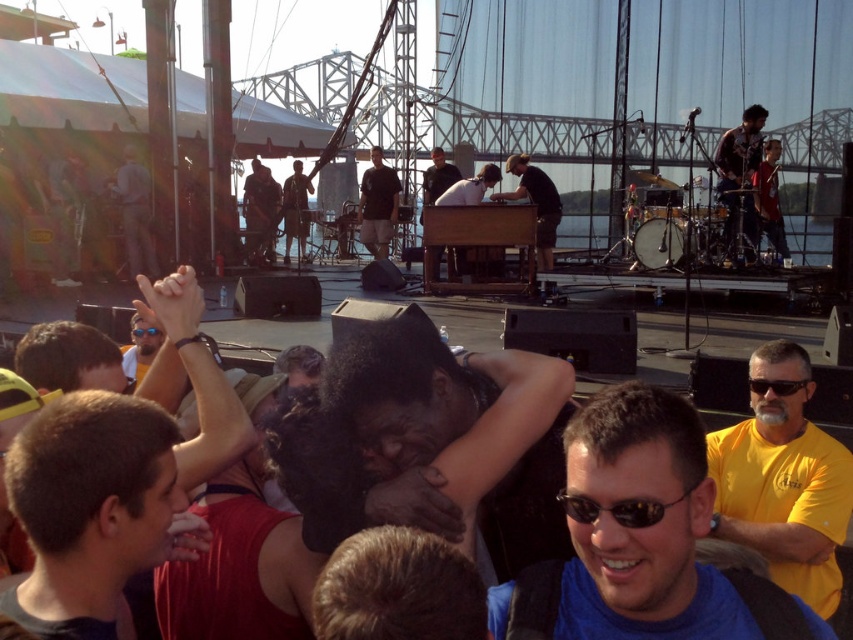
Is dark brown shirt at center bigger than blue plastic goggles at upper center?

Correct, dark brown shirt at center is larger in size than blue plastic goggles at upper center.

Between dark brown shirt at center and blue plastic goggles at upper center, which one has less height?

blue plastic goggles at upper center is shorter.

Which is in front, point (398, 182) or point (155, 326)?

Point (155, 326) is in front.

This screenshot has width=853, height=640. Identify the location of dark brown shirt at center. (376, 204).

Is yellow t-shirt at right shorter than matte black shirt at center?

No.

Between yellow t-shirt at right and matte black shirt at center, which one has less height?

Standing shorter between the two is matte black shirt at center.

Where is `yellow t-shirt at right`? yellow t-shirt at right is located at coordinates (782, 483).

Does blue fabric shirt at center appear on the left side of matte black keyboard at center?

Incorrect, blue fabric shirt at center is not on the left side of matte black keyboard at center.

Is point (579, 620) closer to camera compared to point (519, 184)?

Yes, it is.

Locate an element on the screen. blue fabric shirt at center is located at coordinates (631, 532).